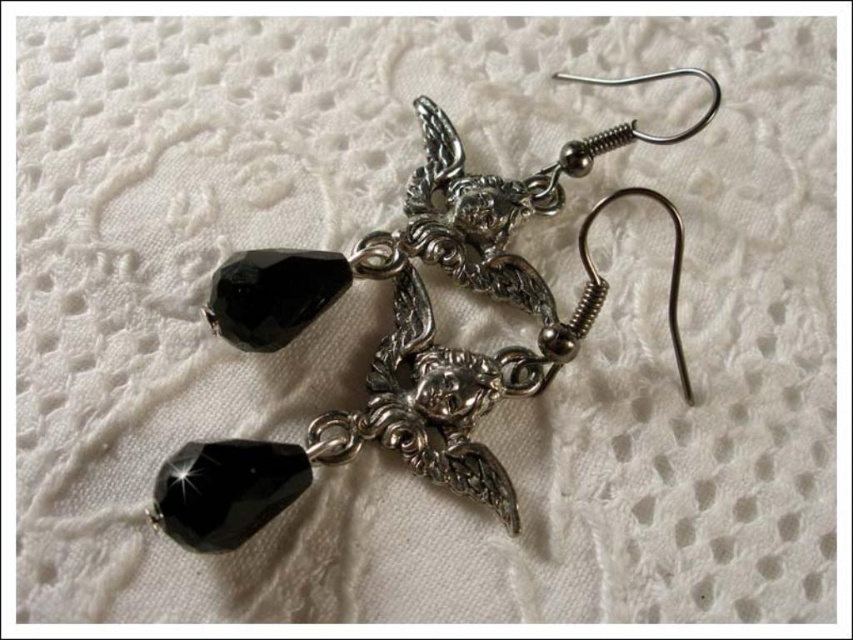
You are an appraiser examining the earrings. You notice two specific points on the earrings at coordinates point (479, 289) and point (242, 472). Which point is closer to the observer?

Point (242, 472) is closer to the observer because point (479, 289) is behind it.

You are a jeweler examining the earrings. You need to determine which component is bigger between the silver metallic hook at center and the black faceted glass bead at lower left. Which one is larger?

The silver metallic hook at center is larger in size than the black faceted glass bead at lower left according to the description.